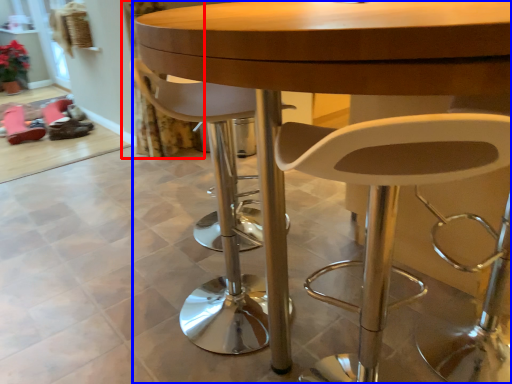
Question: Which point is closer to the camera, curtain (highlighted by a red box) or table (highlighted by a blue box)?

Choices:
 (A) curtain
 (B) table

Answer: (B)